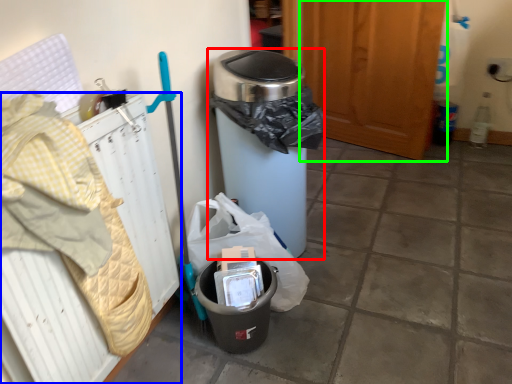
Question: Which is farther away from waste container (highlighted by a red box)? radiator (highlighted by a blue box) or screen door (highlighted by a green box)?

Choices:
 (A) radiator
 (B) screen door

Answer: (B)